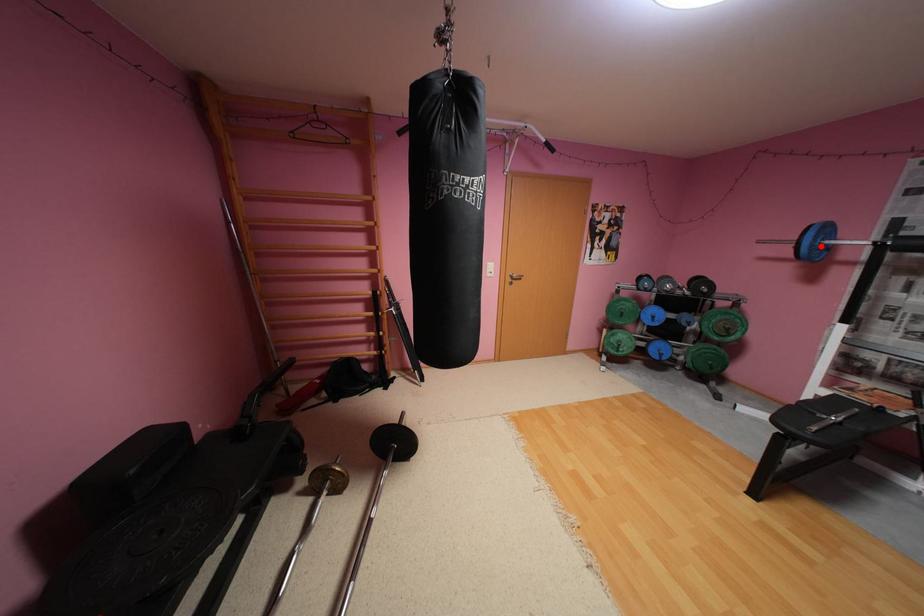
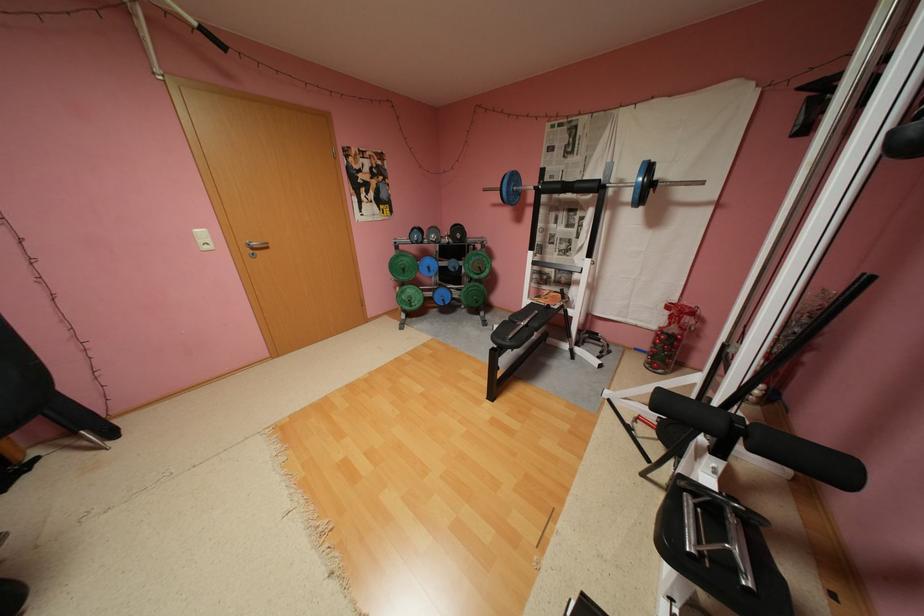
In the second image, find the point that corresponds to the highlighted location in the first image.

(517, 191)